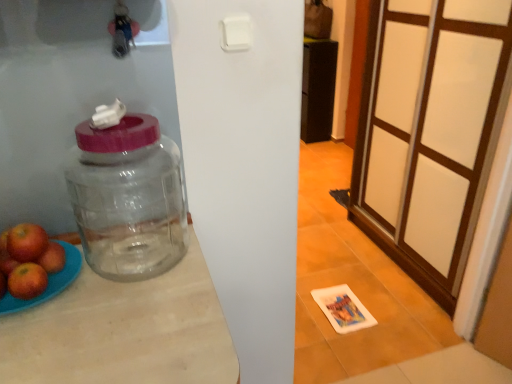
Find the location of a particular element. Image resolution: width=512 pixels, height=384 pixels. free spot above clear wood table at center (from a real-world perspective) is located at coordinates 154,289.